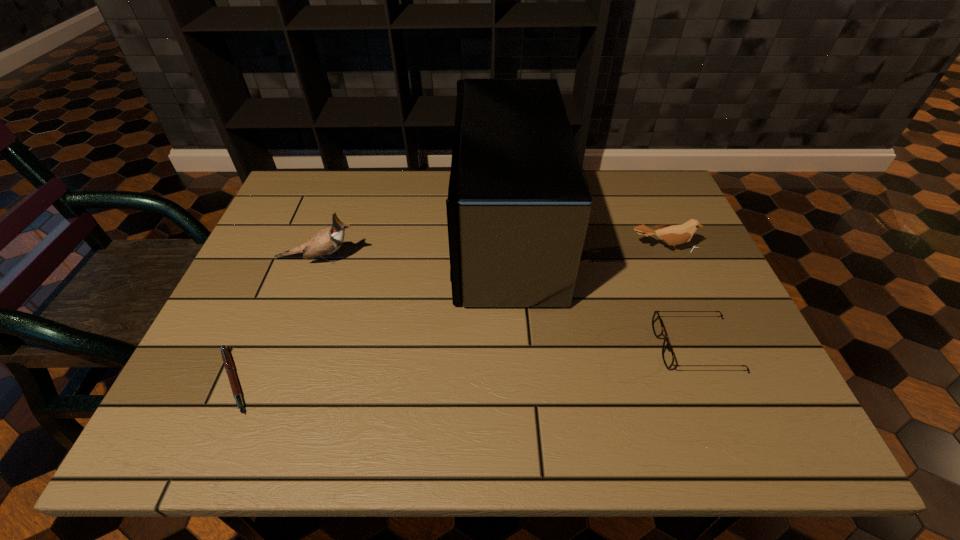
The image size is (960, 540). Find the location of `free space located on the front-facing side of the tallest object`. free space located on the front-facing side of the tallest object is located at coordinates (380, 231).

Find the location of `free space located at the face of the fourth shortest object`. free space located at the face of the fourth shortest object is located at coordinates (422, 259).

I want to click on free space located at the beak of the right bird, so click(x=680, y=287).

The image size is (960, 540). What are the coordinates of `vacant region located 0.080m on the front-facing side of the second shortest object` in the screenshot? It's located at (620, 347).

Identify the location of vacant area situated on the front-facing side of the second shortest object. The image size is (960, 540). 493,347.

Locate an element on the screen. The height and width of the screenshot is (540, 960). vacant space located on the front-facing side of the second shortest object is located at coordinates (612, 347).

The height and width of the screenshot is (540, 960). In order to click on vacant area located 0.190m at the nib of the pen in this screenshot , I will do `click(354, 380)`.

At what (x,y) coordinates should I click in order to perform the action: click on object present at the far edge. Please return your answer as a coordinate pair (x, y). This screenshot has height=540, width=960. Looking at the image, I should click on (518, 207).

Identify the location of object at the near edge. (228, 364).

You are a GUI agent. You are given a task and a screenshot of the screen. Output one action in this format:
    pyautogui.click(x=<x>, y=<y>)
    Task: Click on the bird that is positioned at the left edge
    
    Given the screenshot: What is the action you would take?
    pyautogui.click(x=326, y=241)